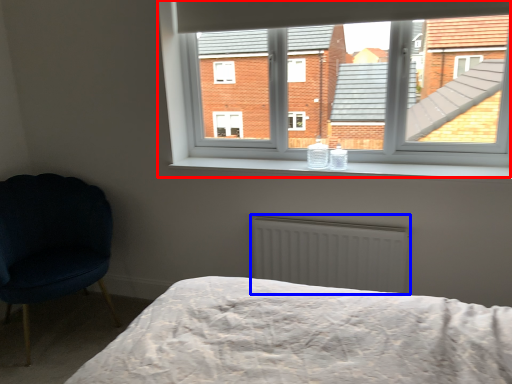
Question: Which point is further to the camera, window (highlighted by a red box) or radiator (highlighted by a blue box)?

Choices:
 (A) window
 (B) radiator

Answer: (B)